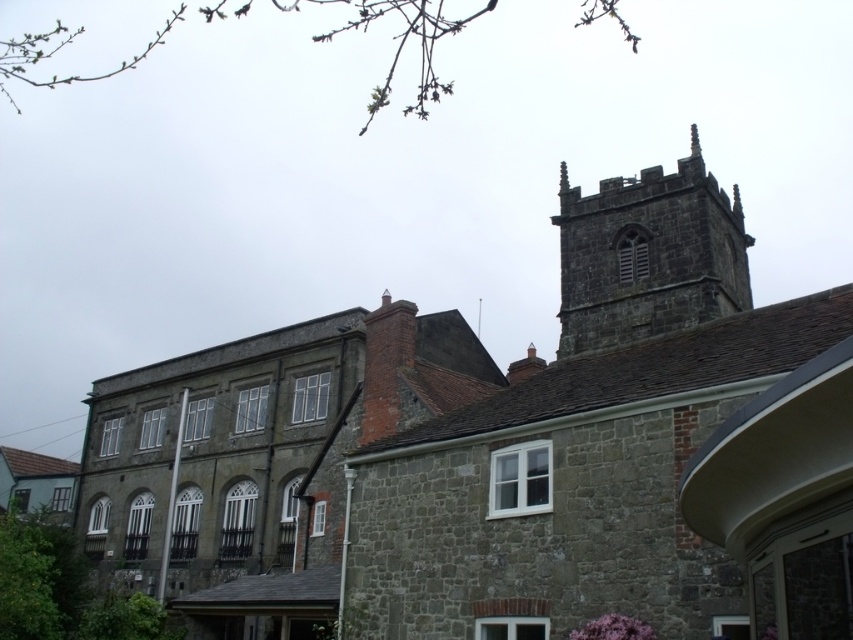
You are a tourist standing in front of the historic stone building. You notice the dark stone church at upper center and the dark stone tower at upper right. Which structure appears bigger to you?

The dark stone church at upper center is larger in size than the dark stone tower at upper right, so the dark stone church at upper center appears bigger.

Based on the photo, you are standing in front of the historic stone building and want to take a photo. You notice two points marked on the tower. The first point is at coordinates point (808, 333) and the second is at point (666, 257). Which point is closer to your current position?

Point (808, 333) is closer to the camera than point (666, 257), so the first point is closer to your current position.

Based on the photo, you are standing in front of a historic stone building. You want to locate the dark stone church at upper center. According to the coordinates provided, where should you look?

The dark stone church at upper center is located at coordinates point [520,449].